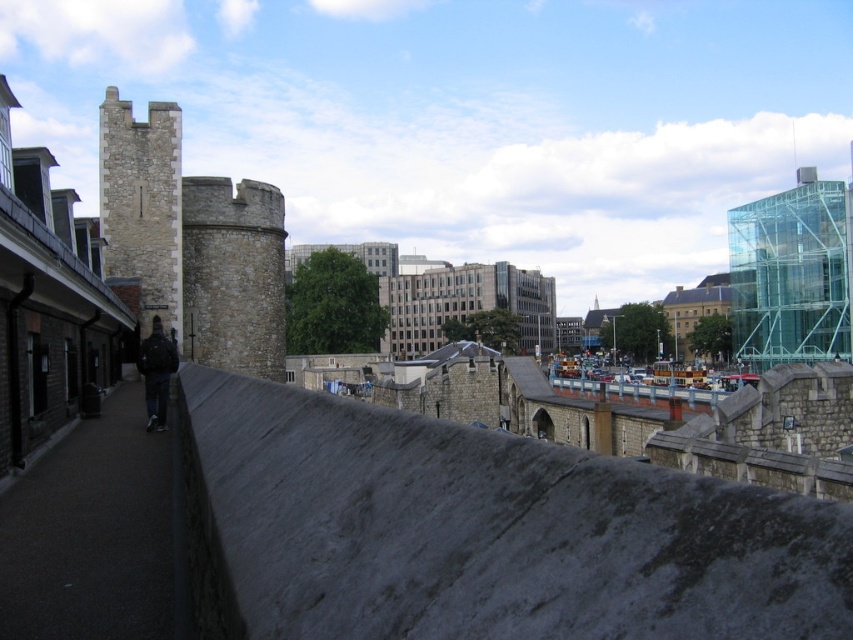
Question: Based on their relative distances, which object is nearer to the light beige stone tower at left?

Choices:
 (A) stone tower at left
 (B) dark blue jacket at center

Answer: (A)

Question: Can you confirm if stone tower at left is positioned to the right of dark blue jacket at center?

Choices:
 (A) yes
 (B) no

Answer: (A)

Question: Can you confirm if transparent glass building at right is positioned below dark blue jacket at center?

Choices:
 (A) yes
 (B) no

Answer: (B)

Question: Which of the following is the closest to the observer?

Choices:
 (A) (106, 216)
 (B) (134, 241)
 (C) (164, 376)

Answer: (C)

Question: Considering the real-world distances, which object is farthest from the stone tower at left?

Choices:
 (A) transparent glass building at right
 (B) dark blue jacket at center

Answer: (A)

Question: Is transparent glass building at right positioned at the back of light beige stone tower at left?

Choices:
 (A) no
 (B) yes

Answer: (B)